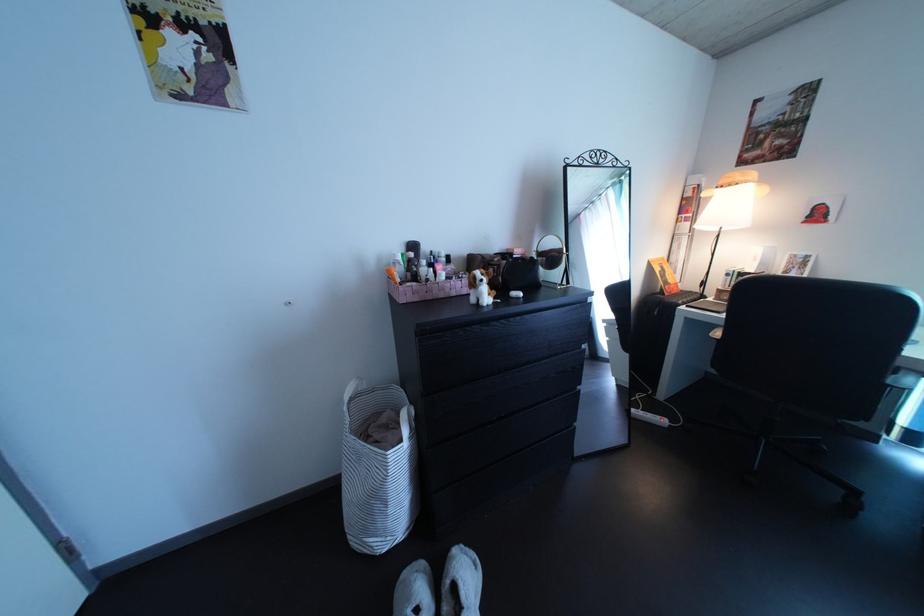
Which object does [421,270] point to?

It corresponds to the white cosmetic bottle in the image.